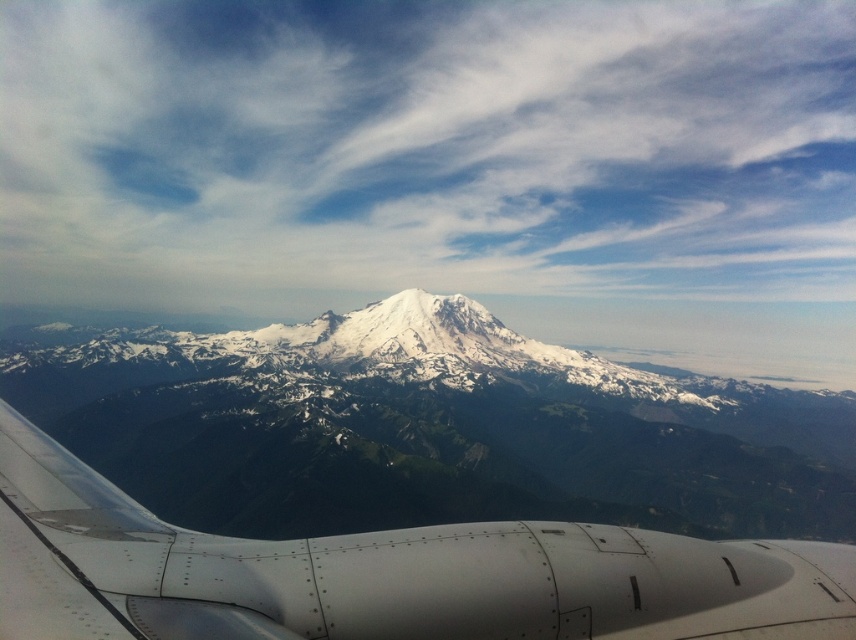
Between white fluffy cloud at upper center and white metallic engine at lower left, which one appears on the right side from the viewer's perspective?

Positioned to the right is white metallic engine at lower left.

Between white fluffy cloud at upper center and white metallic engine at lower left, which one has less height?

white metallic engine at lower left is shorter.

Locate an element on the screen. The image size is (856, 640). white fluffy cloud at upper center is located at coordinates (425, 148).

Image resolution: width=856 pixels, height=640 pixels. Find the location of `white fluffy cloud at upper center`. white fluffy cloud at upper center is located at coordinates (425, 148).

Which is more to the right, white fluffy cloud at upper center or white snow-covered mountain range at center?

From the viewer's perspective, white snow-covered mountain range at center appears more on the right side.

Is white fluffy cloud at upper center wider than white snow-covered mountain range at center?

Correct, the width of white fluffy cloud at upper center exceeds that of white snow-covered mountain range at center.

Image resolution: width=856 pixels, height=640 pixels. Identify the location of white fluffy cloud at upper center. (425, 148).

Is white snow-covered mountain range at center further to camera compared to white metallic engine at lower left?

Yes.

Does white snow-covered mountain range at center have a greater height compared to white metallic engine at lower left?

Yes.

The height and width of the screenshot is (640, 856). In order to click on white snow-covered mountain range at center in this screenshot , I will do `click(429, 428)`.